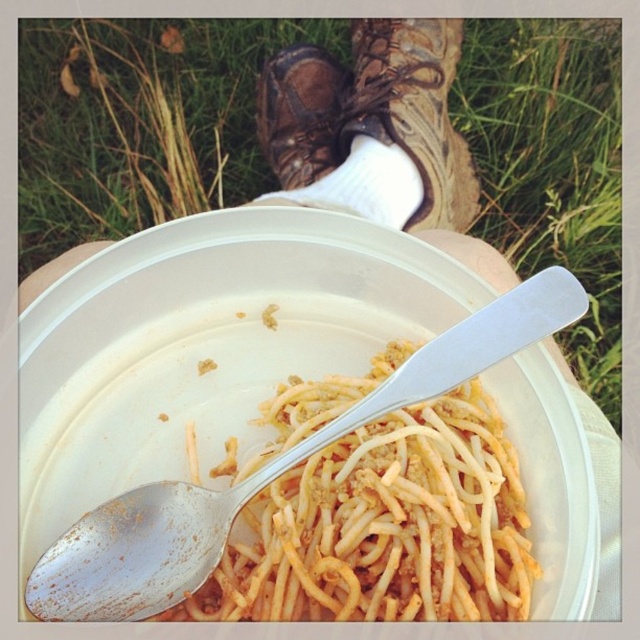
You are a photographer trying to capture the leather boot at center in your shot. However, the green grass at upper center is blocking your view. Can you move the grass to get a clear photo of the boot?

The green grass at upper center is positioned over leather boot at center, so you cannot move the grass as it is part of the scene. You would need to adjust your angle or move closer to avoid the obstruction.

You are a food inspector checking the portion size of the meal. The standard requires that the pasta must occupy at least half the width of the bowl. Based on the provided information, does the yellowish matte pasta at center meet the standard in the white plastic bowl at center?

The yellowish matte pasta at center has a width less than the white plastic bowl at center, so it does not meet the standard requirement of occupying at least half the width of the bowl.